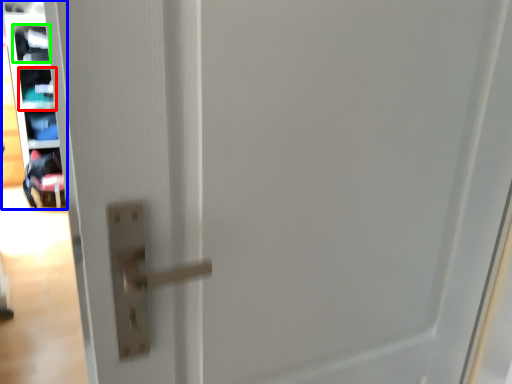
Question: Which is farther away from shelf (highlighted by a red box)? shelf (highlighted by a blue box) or shelf (highlighted by a green box)?

Choices:
 (A) shelf
 (B) shelf

Answer: (A)